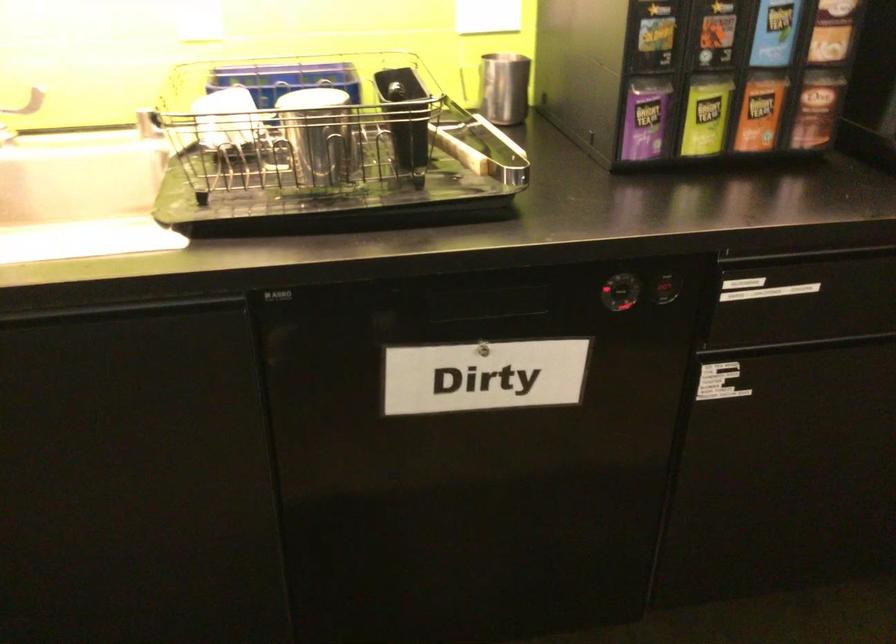
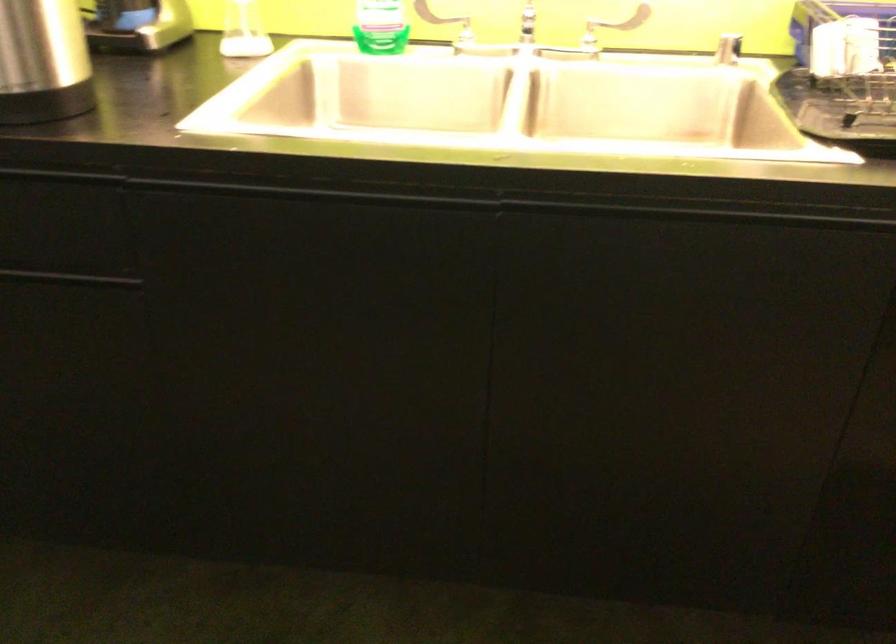
Question: Based on the continuous images, in which direction is the camera rotating? Reply with the corresponding letter.

Choices:
 (A) Left
 (B) Right
 (C) Up
 (D) Down

Answer: (A)